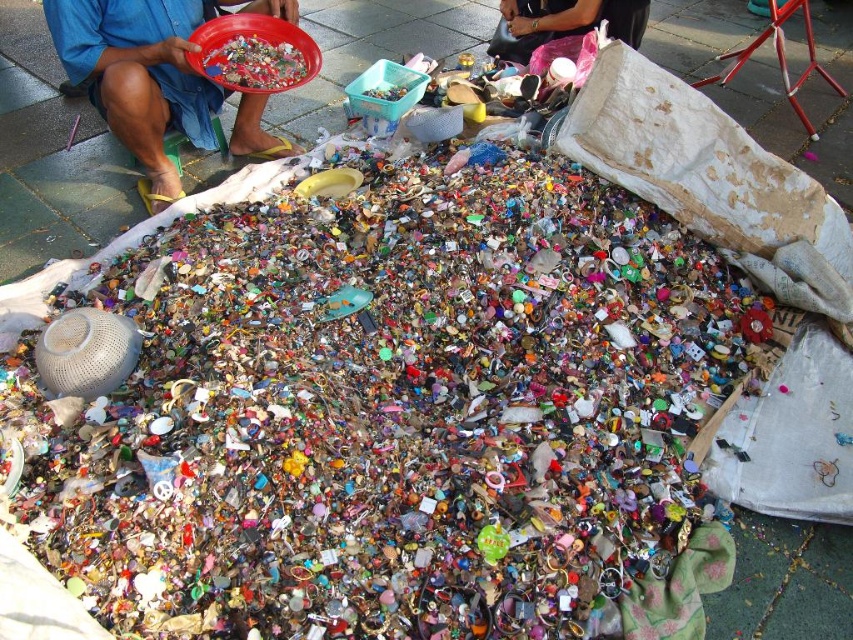
Based on the photo, you are standing at the entrance of the market and see the blue denim shorts at upper left and the matte black bag at upper center. Which object is closer to the ground?

The blue denim shorts at upper left is located below the matte black bag at upper center, so it is closer to the ground.

Based on the photo, you are standing at the entrance of the market and see the blue denim shorts at upper left and the matte black bag at upper center. Which object is positioned more to the left side of the image?

The blue denim shorts at upper left is positioned more to the left than the matte black bag at upper center.

You are a customer at the market and want to buy both the blue denim shorts at upper left and the matte black bag at upper center. However, you have a size restriction and can only carry items that are smaller than a standard backpack. Which item should you choose?

The matte black bag at upper center is smaller than the blue denim shorts at upper left, so you should choose the matte black bag at upper center since it is smaller and likely fits within the size restriction.